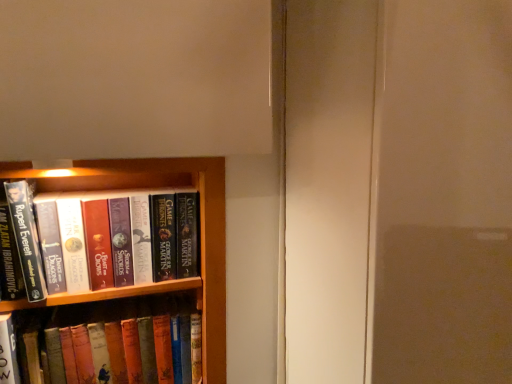
Where is `hardcover book at left, which is counted as the second book, starting from the top`? The width and height of the screenshot is (512, 384). hardcover book at left, which is counted as the second book, starting from the top is located at coordinates (122, 343).

What do you see at coordinates (122, 343) in the screenshot?
I see `hardcover book at left, which is counted as the second book, starting from the top` at bounding box center [122, 343].

Describe the element at coordinates (85, 239) in the screenshot. I see `hardcover books at left, positioned as the 2th book in bottom-to-top order` at that location.

In order to click on hardcover books at left, positioned as the 2th book in bottom-to-top order in this screenshot , I will do `click(85, 239)`.

Identify the location of hardcover book at left, marked as the 1th book in a bottom-to-top arrangement. (122, 343).

Can you confirm if hardcover books at left, positioned as the 2th book in bottom-to-top order, is positioned to the left of hardcover book at left, which is counted as the second book, starting from the top?

In fact, hardcover books at left, positioned as the 2th book in bottom-to-top order, is to the right of hardcover book at left, which is counted as the second book, starting from the top.

Is the depth of hardcover books at left, positioned as the 2th book in bottom-to-top order, greater than that of hardcover book at left, marked as the 1th book in a bottom-to-top arrangement?

No, hardcover books at left, positioned as the 2th book in bottom-to-top order, is in front of hardcover book at left, marked as the 1th book in a bottom-to-top arrangement.

Consider the image. Which is farther, (134, 199) or (194, 374)?

The point (194, 374) is behind.

Looking at this image, from the image's perspective, is hardcover books at left, positioned as the 2th book in bottom-to-top order, over hardcover book at left, marked as the 1th book in a bottom-to-top arrangement?

Indeed, from the image's perspective, hardcover books at left, positioned as the 2th book in bottom-to-top order, is shown above hardcover book at left, marked as the 1th book in a bottom-to-top arrangement.

From a real-world perspective, is hardcover books at left, positioned as the 2th book in bottom-to-top order, over hardcover book at left, which is counted as the second book, starting from the top?

Indeed, from a real-world perspective, hardcover books at left, positioned as the 2th book in bottom-to-top order, stands above hardcover book at left, which is counted as the second book, starting from the top.

Can you confirm if hardcover books at left, positioned as the 2th book in bottom-to-top order, is wider than hardcover book at left, which is counted as the second book, starting from the top?

Yes, hardcover books at left, positioned as the 2th book in bottom-to-top order, is wider than hardcover book at left, which is counted as the second book, starting from the top.

Which of these two, hardcover books at left, the first book when ordered from top to bottom, or hardcover book at left, marked as the 1th book in a bottom-to-top arrangement, stands taller?

With more height is hardcover book at left, marked as the 1th book in a bottom-to-top arrangement.

Can you confirm if hardcover books at left, positioned as the 2th book in bottom-to-top order, is bigger than hardcover book at left, which is counted as the second book, starting from the top?

No.

Which is correct: hardcover books at left, the first book when ordered from top to bottom, is inside hardcover book at left, which is counted as the second book, starting from the top, or outside of it?

hardcover books at left, the first book when ordered from top to bottom, is located beyond the bounds of hardcover book at left, which is counted as the second book, starting from the top.

In the scene shown: Is hardcover books at left, positioned as the 2th book in bottom-to-top order, directly adjacent to hardcover book at left, marked as the 1th book in a bottom-to-top arrangement?

hardcover books at left, positioned as the 2th book in bottom-to-top order, is not next to hardcover book at left, marked as the 1th book in a bottom-to-top arrangement, and they're not touching.

Consider the image. Is hardcover books at left, positioned as the 2th book in bottom-to-top order, facing towards hardcover book at left, which is counted as the second book, starting from the top?

No, hardcover books at left, positioned as the 2th book in bottom-to-top order, is not aimed at hardcover book at left, which is counted as the second book, starting from the top.

Identify the location of book on the right of hardcover book at left, marked as the 1th book in a bottom-to-top arrangement. This screenshot has width=512, height=384. (85, 239).

Based on their positions, is hardcover book at left, which is counted as the second book, starting from the top, located to the left or right of hardcover books at left, the first book when ordered from top to bottom?

hardcover book at left, which is counted as the second book, starting from the top, is positioned on hardcover books at left, the first book when ordered from top to bottom,'s left side.

In the image, is hardcover book at left, marked as the 1th book in a bottom-to-top arrangement, positioned in front of or behind hardcover books at left, the first book when ordered from top to bottom?

In the image, hardcover book at left, marked as the 1th book in a bottom-to-top arrangement, appears behind hardcover books at left, the first book when ordered from top to bottom.

Is point (184, 305) in front of point (149, 194)?

No, (184, 305) is behind (149, 194).

From the image's perspective, which is below, hardcover book at left, which is counted as the second book, starting from the top, or hardcover books at left, the first book when ordered from top to bottom?

hardcover book at left, which is counted as the second book, starting from the top, appears lower in the image.

From a real-world perspective, is hardcover book at left, which is counted as the second book, starting from the top, positioned above or below hardcover books at left, positioned as the 2th book in bottom-to-top order?

hardcover book at left, which is counted as the second book, starting from the top, is below hardcover books at left, positioned as the 2th book in bottom-to-top order.

Which object is wider, hardcover book at left, which is counted as the second book, starting from the top, or hardcover books at left, the first book when ordered from top to bottom?

With larger width is hardcover books at left, the first book when ordered from top to bottom.

Does hardcover book at left, marked as the 1th book in a bottom-to-top arrangement, have a greater height compared to hardcover books at left, the first book when ordered from top to bottom?

Correct, hardcover book at left, marked as the 1th book in a bottom-to-top arrangement, is much taller as hardcover books at left, the first book when ordered from top to bottom.

Looking at this image, considering the sizes of objects hardcover book at left, marked as the 1th book in a bottom-to-top arrangement, and hardcover books at left, the first book when ordered from top to bottom, in the image provided, who is bigger, hardcover book at left, marked as the 1th book in a bottom-to-top arrangement, or hardcover books at left, the first book when ordered from top to bottom,?

Answer: hardcover book at left, marked as the 1th book in a bottom-to-top arrangement, is bigger.

Is hardcover book at left, marked as the 1th book in a bottom-to-top arrangement, surrounding hardcover books at left, positioned as the 2th book in bottom-to-top order?

No, hardcover book at left, marked as the 1th book in a bottom-to-top arrangement, does not contain hardcover books at left, positioned as the 2th book in bottom-to-top order.

Is hardcover book at left, which is counted as the second book, starting from the top, oriented away from hardcover books at left, the first book when ordered from top to bottom?

No, hardcover book at left, which is counted as the second book, starting from the top, is not facing the opposite direction of hardcover books at left, the first book when ordered from top to bottom.

Can you tell me how much hardcover book at left, marked as the 1th book in a bottom-to-top arrangement, and hardcover books at left, the first book when ordered from top to bottom, differ in facing direction?

0.00167 degrees.

You are a GUI agent. You are given a task and a screenshot of the screen. Output one action in this format:
    pyautogui.click(x=<x>, y=<y>)
    Task: Click on the book that is in front of the hardcover book at left, which is counted as the second book, starting from the top
    The height and width of the screenshot is (384, 512).
    Given the screenshot: What is the action you would take?
    pyautogui.click(x=85, y=239)

Where is `book located in front of the hardcover book at left, marked as the 1th book in a bottom-to-top arrangement`? The image size is (512, 384). book located in front of the hardcover book at left, marked as the 1th book in a bottom-to-top arrangement is located at coordinates tap(85, 239).

Image resolution: width=512 pixels, height=384 pixels. Find the location of `book located underneath the hardcover books at left, positioned as the 2th book in bottom-to-top order (from a real-world perspective)`. book located underneath the hardcover books at left, positioned as the 2th book in bottom-to-top order (from a real-world perspective) is located at coordinates (122, 343).